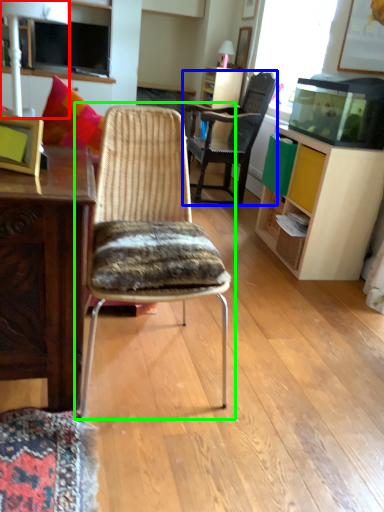
Question: Which is farther away from lamp (highlighted by a red box)? chair (highlighted by a blue box) or chair (highlighted by a green box)?

Choices:
 (A) chair
 (B) chair

Answer: (B)